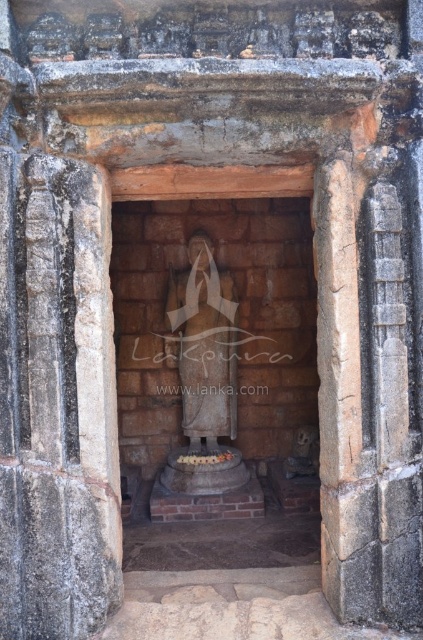
Is brown stone statue at center in front of stone statue at center?

Yes, brown stone statue at center is closer to the viewer.

Is brown stone statue at center further to camera compared to stone statue at center?

No, brown stone statue at center is closer to the viewer.

The width and height of the screenshot is (423, 640). I want to click on brown stone statue at center, so click(214, 364).